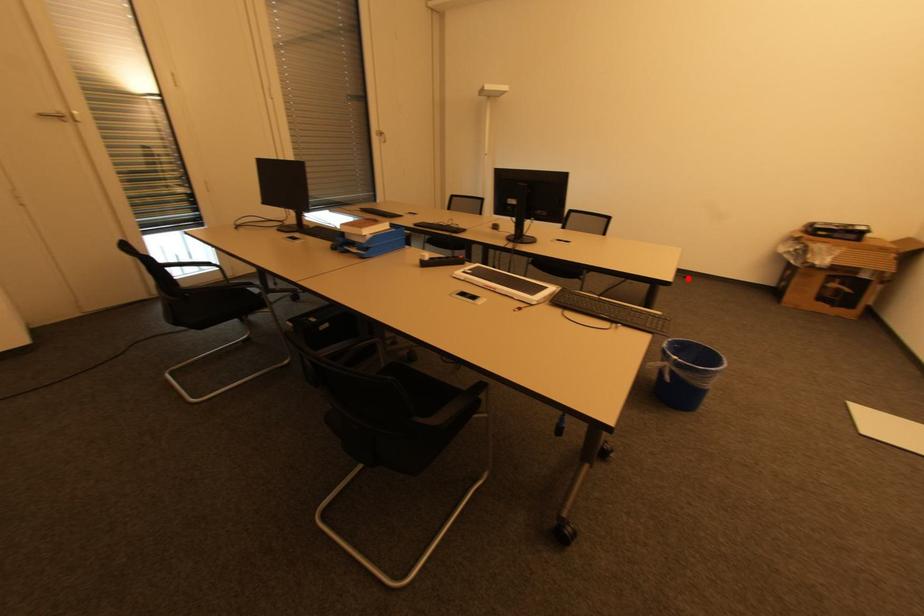
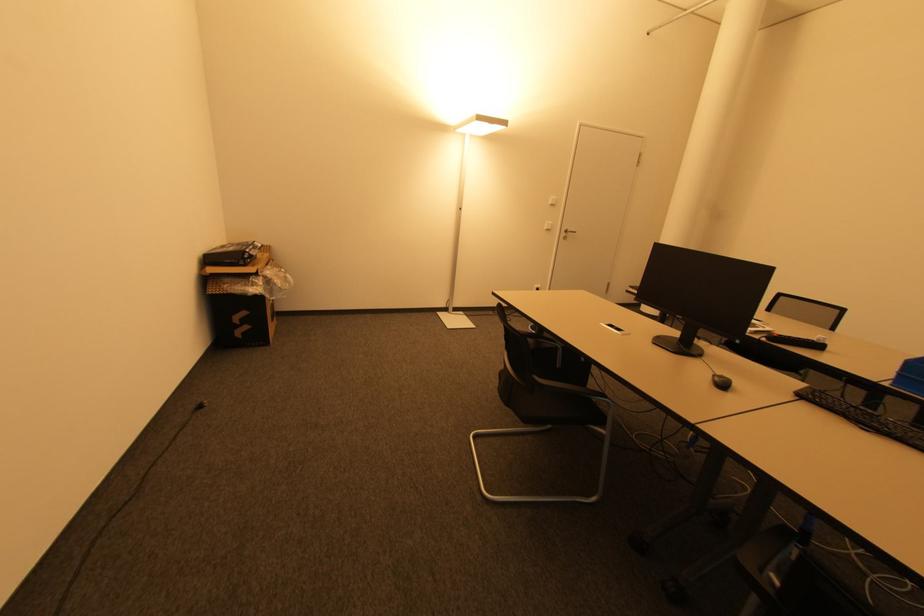
In the second image, find the point that corresponds to the highlighted location in the first image.

(201, 408)